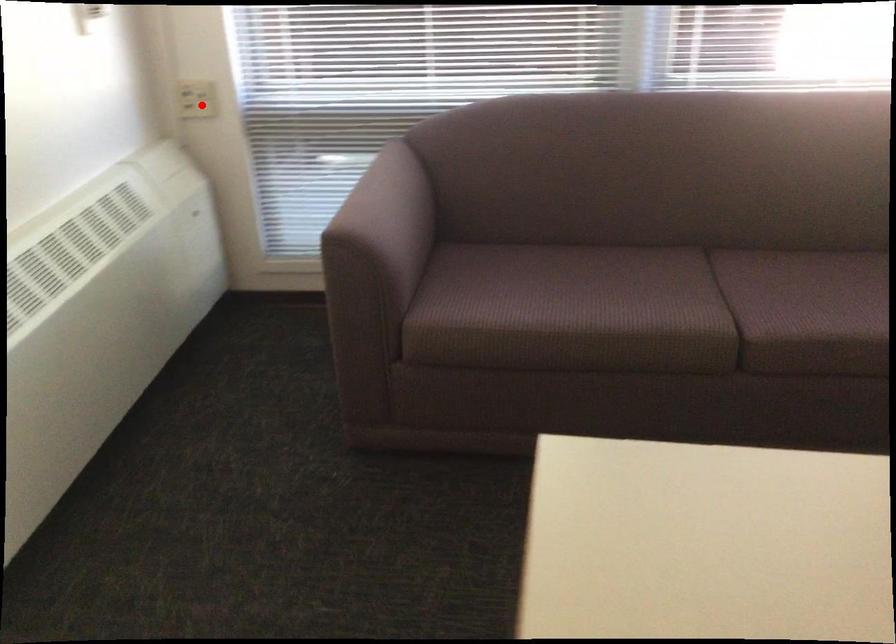
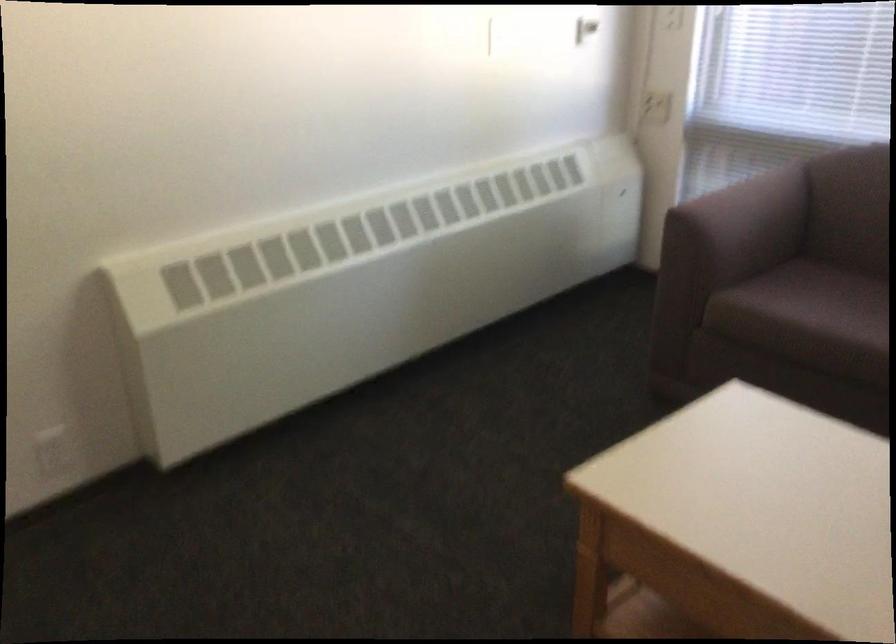
Where in the second image is the point corresponding to the highlighted location from the first image?

(656, 107)